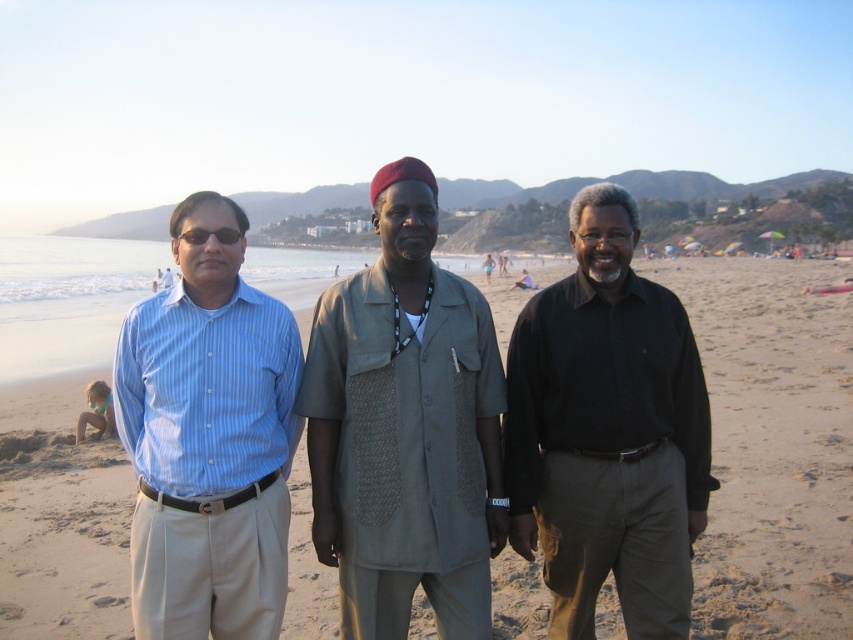
Based on the photo, you are a photographer standing on the beach and want to take a photo of the beige sand at center and the blue striped shirt at left. The camera you are using has a maximum focus range of 15 meters. Will both subjects be in focus at the same time?

The beige sand at center and blue striped shirt at left are 15.42 meters apart, so the distance between them exceeds the camera maximum focus range of 15 meters. Therefore, both subjects cannot be in focus simultaneously.

You are a photographer setting up a tripod to take a group photo of the khaki textured shirt at center and the blue striped shirt at left. Based on their heights, which person should stand closer to the camera to ensure both are in focus?

The khaki textured shirt at center is taller than the blue striped shirt at left, so the shorter blue striped shirt at left should stand closer to the camera to ensure both are in focus.

You are a photographer trying to capture a sunset photo. You see the beige sand at center and the blue striped shirt at left. Which one is positioned higher in the frame?

The beige sand at center is positioned higher than the blue striped shirt at left in the frame.